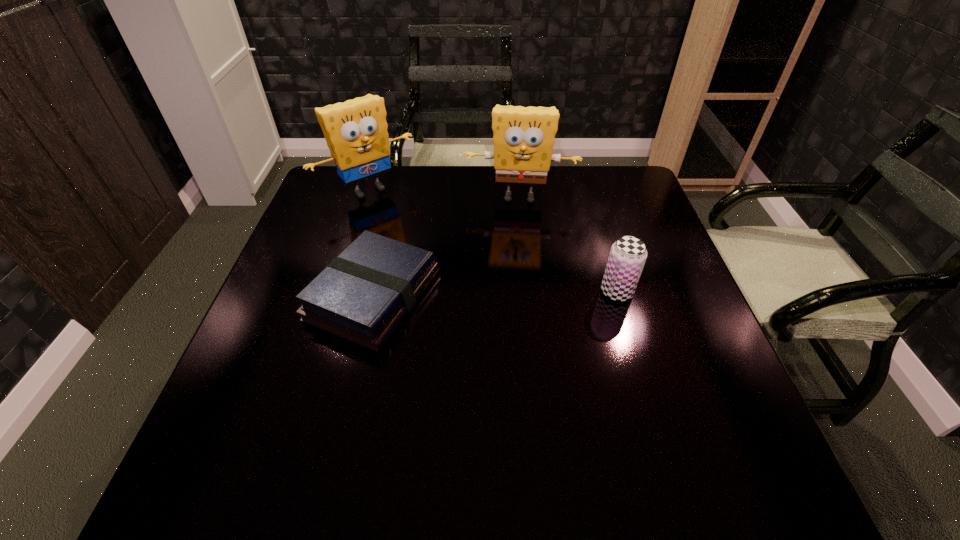
Image resolution: width=960 pixels, height=540 pixels. In the image, there is a desktop. In order to click on free region at the right edge in this screenshot , I will do `click(641, 294)`.

Identify the location of free spot at the far left corner of the desktop. (362, 181).

Find the location of a particular element. free space at the near left corner of the desktop is located at coordinates (232, 390).

Where is `free space between the book and the beer can`? The height and width of the screenshot is (540, 960). free space between the book and the beer can is located at coordinates (495, 294).

The image size is (960, 540). I want to click on free space between the book and the beer can, so click(x=495, y=294).

The image size is (960, 540). Find the location of `free space between the beer can and the right sponge`. free space between the beer can and the right sponge is located at coordinates (568, 245).

I want to click on free spot between the right sponge and the beer can, so click(x=568, y=245).

Find the location of a particular element. The width and height of the screenshot is (960, 540). blank region between the third object from left to right and the left sponge is located at coordinates (444, 194).

Locate an element on the screen. The image size is (960, 540). empty location between the beer can and the left sponge is located at coordinates click(x=492, y=241).

You are a GUI agent. You are given a task and a screenshot of the screen. Output one action in this format:
    pyautogui.click(x=<x>, y=<y>)
    Task: Click on the blank region between the right sponge and the left sponge
    
    Given the screenshot: What is the action you would take?
    pyautogui.click(x=444, y=194)